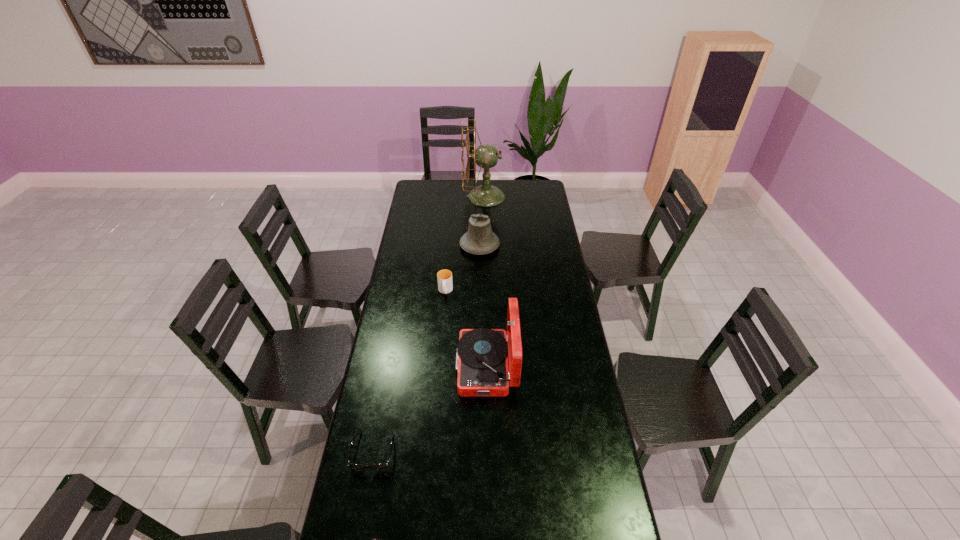
The height and width of the screenshot is (540, 960). I want to click on the tallest object, so click(x=487, y=156).

The width and height of the screenshot is (960, 540). I want to click on the farthest object, so click(487, 156).

Identify the location of phonograph_record. The image size is (960, 540). (482, 364).

You are a GUI agent. You are given a task and a screenshot of the screen. Output one action in this format:
    pyautogui.click(x=<x>, y=<y>)
    Task: Click on the second tallest object
    This screenshot has height=540, width=960.
    Given the screenshot: What is the action you would take?
    pyautogui.click(x=482, y=364)

The height and width of the screenshot is (540, 960). What are the coordinates of `the third tallest object` in the screenshot? It's located at (479, 239).

You are a GUI agent. You are given a task and a screenshot of the screen. Output one action in this format:
    pyautogui.click(x=<x>, y=<y>)
    Task: Click on the fifth nearest object
    Image resolution: width=960 pixels, height=540 pixels.
    Given the screenshot: What is the action you would take?
    pyautogui.click(x=479, y=239)

The width and height of the screenshot is (960, 540). Identify the location of cup. (444, 277).

Image resolution: width=960 pixels, height=540 pixels. I want to click on the third farthest object, so click(x=444, y=277).

Find the location of a particular element. The image size is (960, 540). the second nearest object is located at coordinates (384, 465).

In order to click on spectacles in this screenshot , I will do `click(384, 465)`.